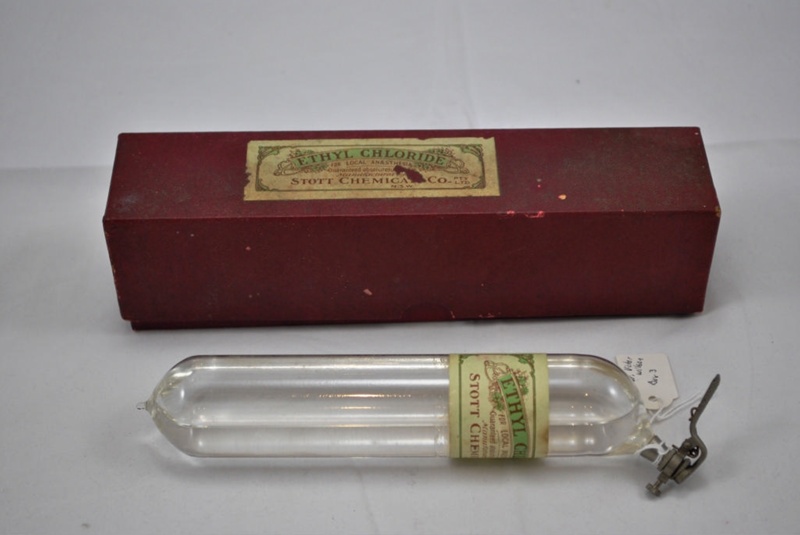
Identify the location of bottom of the lid of the box. (142, 322).